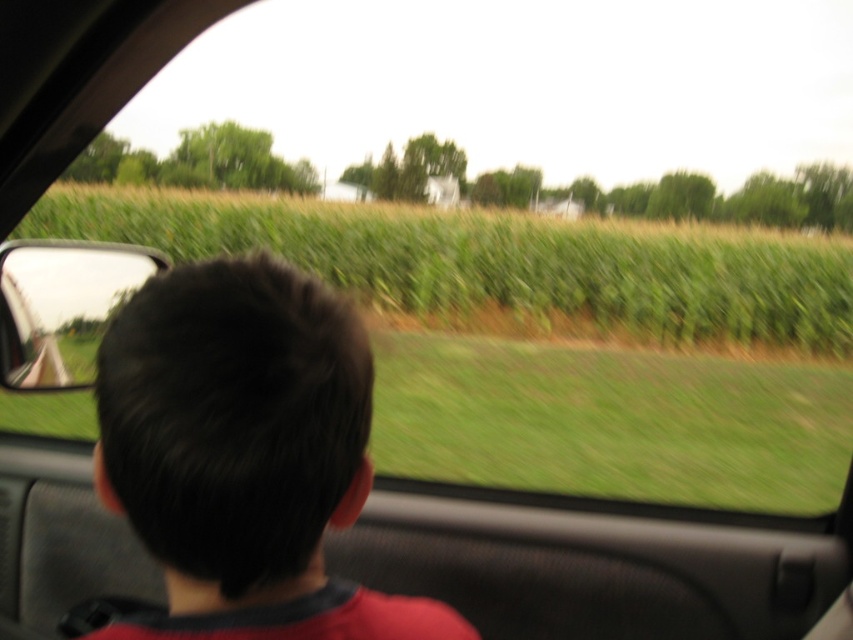
Between point (132, 634) and point (619, 307), which one is positioned behind?

Point (619, 307)

Can you confirm if dark brown hair at center is shorter than green grassy field at center?

Yes.

Who is more forward, (213, 468) or (677, 259)?

Point (213, 468) is in front.

Identify the location of dark brown hair at center. (244, 454).